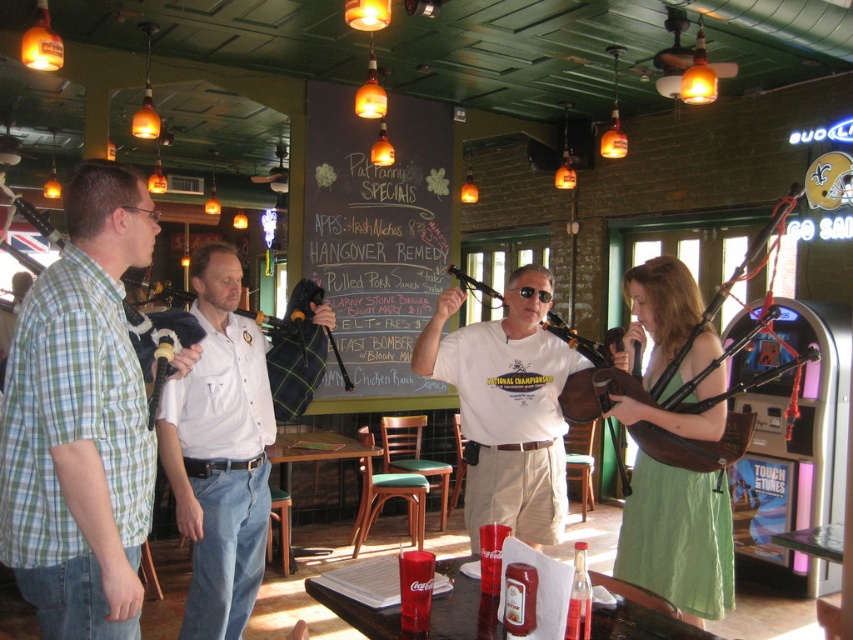
Question: Does chalkboard menu at center have a greater width compared to matte brown bagpipes at center?

Choices:
 (A) yes
 (B) no

Answer: (A)

Question: Based on their relative distances, which object is nearer to the chalkboard menu at center?

Choices:
 (A) green plaid shirt at left
 (B) matte white t-shirt at center

Answer: (B)

Question: Which of the following is the closest to the observer?

Choices:
 (A) white cotton shirt at center
 (B) matte brown bagpipes at center
 (C) green plaid shirt at left
 (D) matte white t-shirt at center

Answer: (C)

Question: Estimate the real-world distances between objects in this image. Which object is farther from the green plaid shirt at left?

Choices:
 (A) matte white t-shirt at center
 (B) chalkboard menu at center
 (C) white cotton shirt at center
 (D) matte brown bagpipes at center

Answer: (B)

Question: Does white cotton shirt at center appear on the left side of matte white t-shirt at center?

Choices:
 (A) yes
 (B) no

Answer: (A)

Question: Does chalkboard menu at center appear under matte brown bagpipes at center?

Choices:
 (A) yes
 (B) no

Answer: (B)